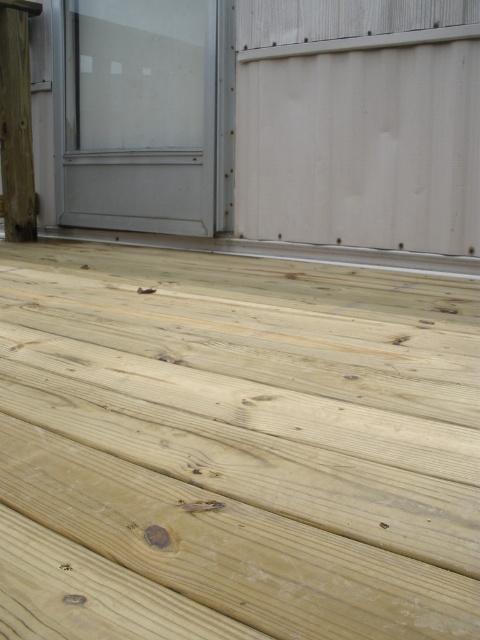
You are standing on the wooden deck and want to place a small potted plant between the two points marked as point (448, 579) and point (26, 230). Which point should you position the plant closer to so that it is nearer to the camera?

The plant should be positioned closer to point (448, 579) because it is closer to the camera than point (26, 230).

You are standing on the natural wood deck at center and want to reach the natural wood post at left. Which direction should you move to get closer to the post?

You should move to the left because the natural wood post at left is positioned to the left of the natural wood deck at center.

You are standing on the natural wood deck at center and want to move to the natural wood post at left. Which direction should you walk to get there?

You should walk to the left to reach the natural wood post at left from the natural wood deck at center since the deck is on the right side of the post.